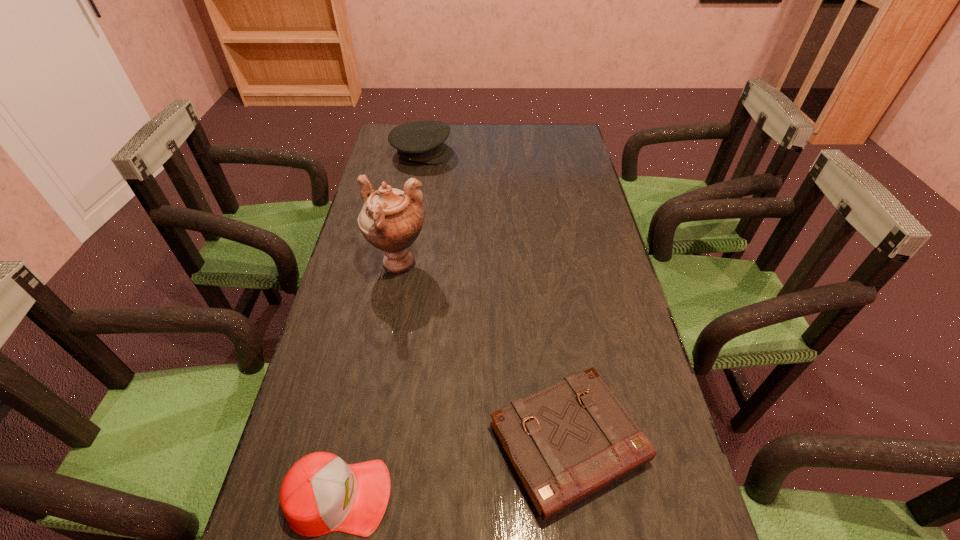
The width and height of the screenshot is (960, 540). I want to click on the tallest object, so click(x=391, y=220).

Find the location of `the second farthest object`. the second farthest object is located at coordinates (391, 220).

Locate an element on the screen. The height and width of the screenshot is (540, 960). the farthest object is located at coordinates (x=422, y=141).

The image size is (960, 540). I want to click on beret, so [422, 141].

Locate an element on the screen. the third tallest object is located at coordinates (320, 494).

Image resolution: width=960 pixels, height=540 pixels. Identify the location of the shortest object. [566, 442].

Locate an element on the screen. hardback book is located at coordinates (566, 442).

Identify the location of vacant space located on the front of the tallest object. Image resolution: width=960 pixels, height=540 pixels. (382, 351).

Locate an element on the screen. The height and width of the screenshot is (540, 960). vacant space located on the front-facing side of the farthest object is located at coordinates (526, 153).

What are the coordinates of `free space located 0.300m on the front-facing side of the baseball cap` in the screenshot? It's located at (554, 496).